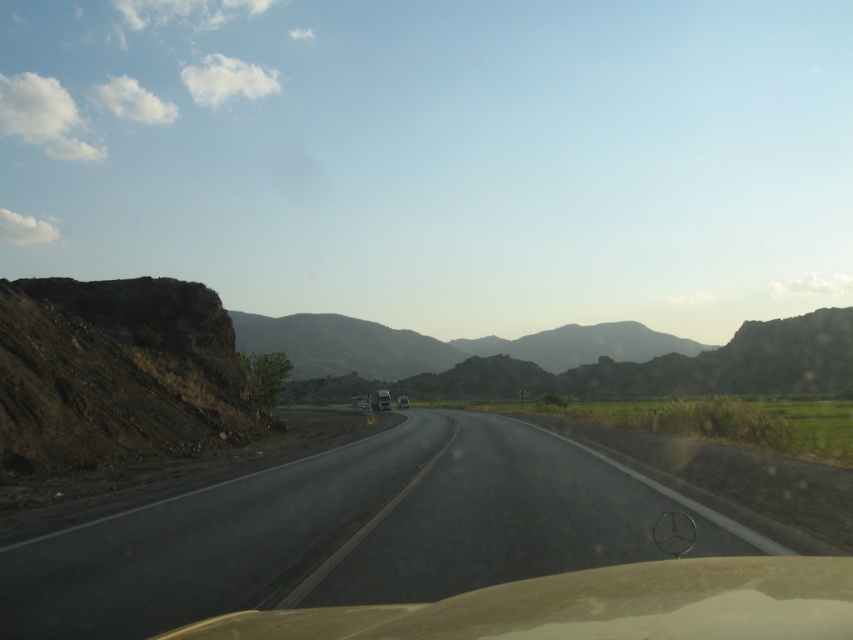
Question: Does rugged brown mountain at center appear under metallic silver van at center?

Choices:
 (A) no
 (B) yes

Answer: (A)

Question: Which point is farther to the camera?

Choices:
 (A) asphalt road at center
 (B) rugged brown mountain at center

Answer: (B)

Question: Is transparent beige car window at center to the left of metallic silver van at center from the viewer's perspective?

Choices:
 (A) no
 (B) yes

Answer: (A)

Question: Does rugged brown mountain at center have a lesser width compared to metallic silver van at center?

Choices:
 (A) no
 (B) yes

Answer: (A)

Question: Considering the real-world distances, which object is closest to the asphalt road at center?

Choices:
 (A) rugged brown mountain at center
 (B) metallic silver van at center
 (C) transparent beige car window at center

Answer: (C)

Question: Which point is farther to the camera?

Choices:
 (A) rugged brown mountain at center
 (B) transparent beige car window at center

Answer: (A)